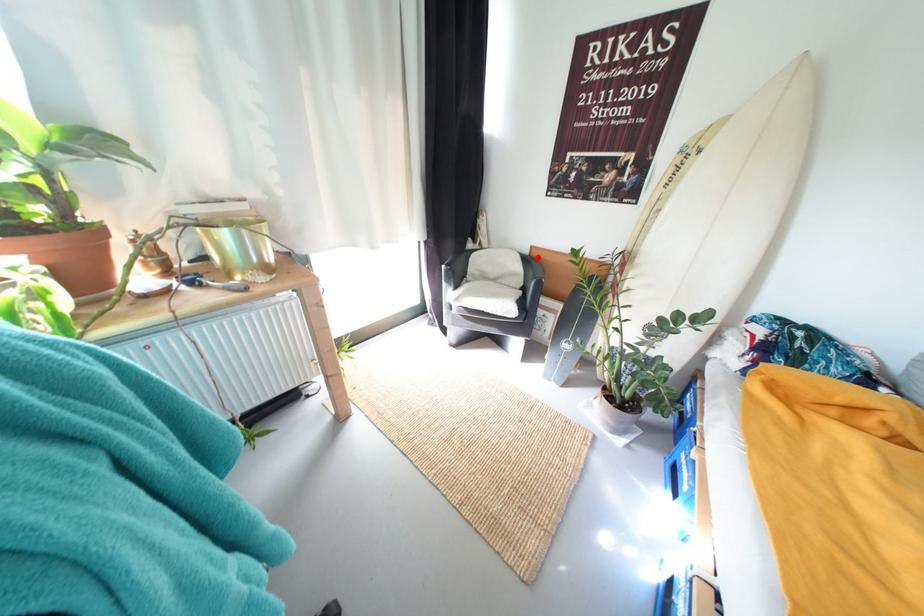
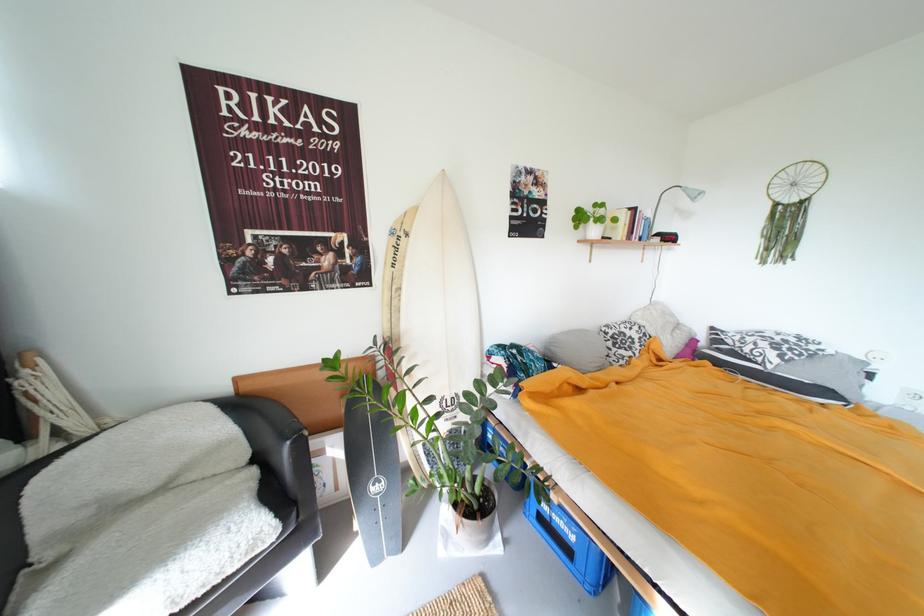
Locate, in the second image, the point that corresponds to the highlighted location in the first image.

(246, 395)